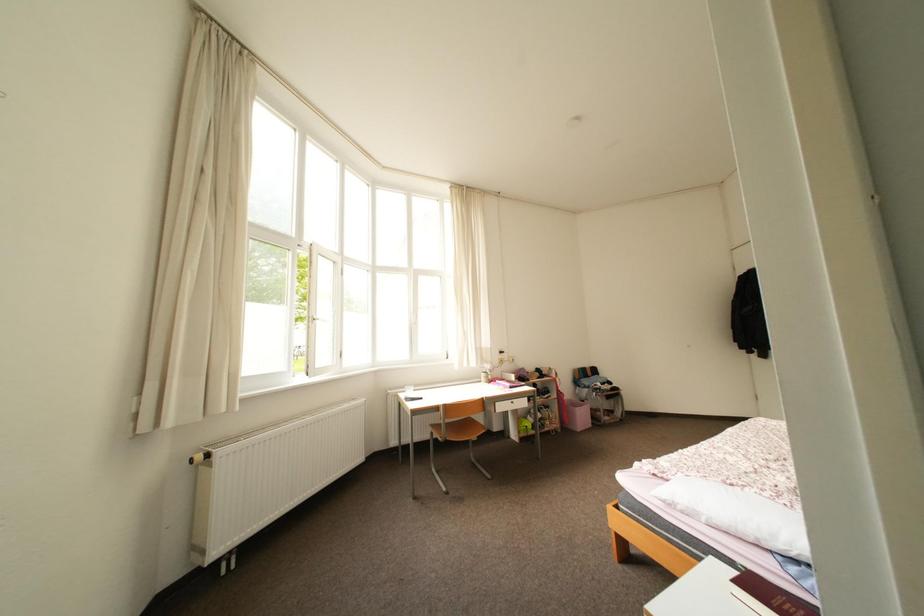
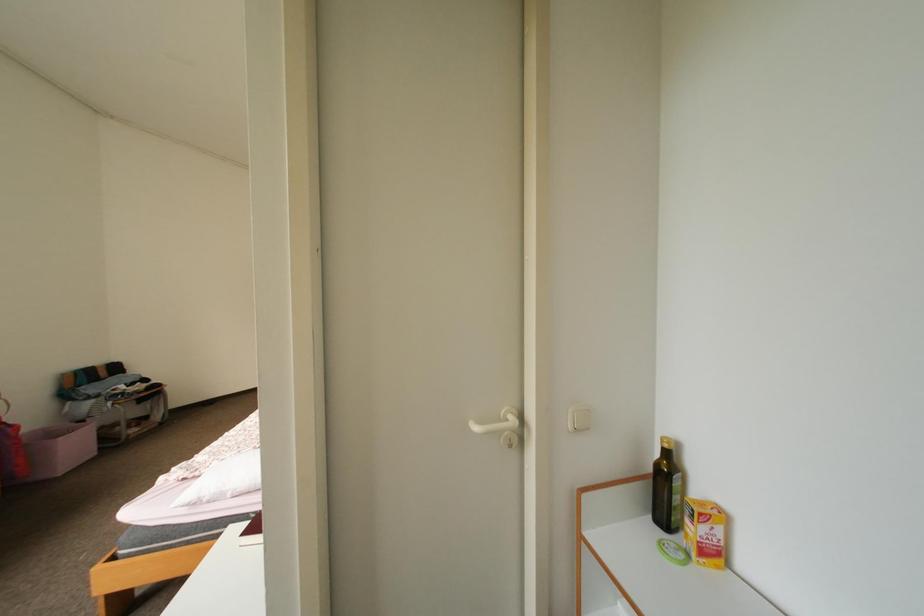
Question: The camera is either moving clockwise (left) or counter-clockwise (right) around the object. The first image is from the beginning of the video and the second image is from the end. Is the camera moving left or right when shooting the video?

Choices:
 (A) Left
 (B) Right

Answer: (A)